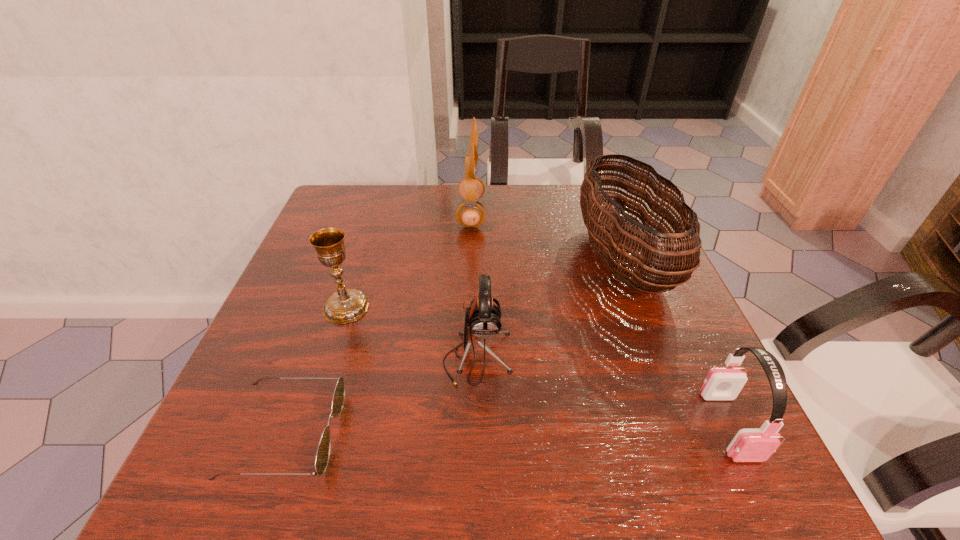
You are a GUI agent. You are given a task and a screenshot of the screen. Output one action in this format:
    pyautogui.click(x=<x>, y=<y>)
    Task: Click on the earphone that is at the right edge
    
    Given the screenshot: What is the action you would take?
    pyautogui.click(x=749, y=445)

Where is `object that is at the near left corner`? This screenshot has width=960, height=540. object that is at the near left corner is located at coordinates (322, 457).

Locate an element on the screen. object that is at the far right corner is located at coordinates (632, 259).

At what (x,y) coordinates should I click in order to perform the action: click on object located at the near right corner. Please return your answer as a coordinate pair (x, y). Looking at the image, I should click on (749, 445).

Find the location of a particular element. This screenshot has width=960, height=540. vacant space at the far edge is located at coordinates (410, 199).

Where is `vacant space at the near edge of the desktop`? This screenshot has height=540, width=960. vacant space at the near edge of the desktop is located at coordinates (435, 497).

Find the location of a particular element. This screenshot has height=540, width=960. vacant space at the left edge of the desktop is located at coordinates (255, 395).

Find the location of a particular element. This screenshot has width=960, height=540. free location at the right edge of the desktop is located at coordinates (628, 352).

In the image, there is a desktop. Find the location of `vacant space at the far left corner`. vacant space at the far left corner is located at coordinates (365, 210).

Where is `free spot at the far right corner of the desktop`? This screenshot has width=960, height=540. free spot at the far right corner of the desktop is located at coordinates (605, 192).